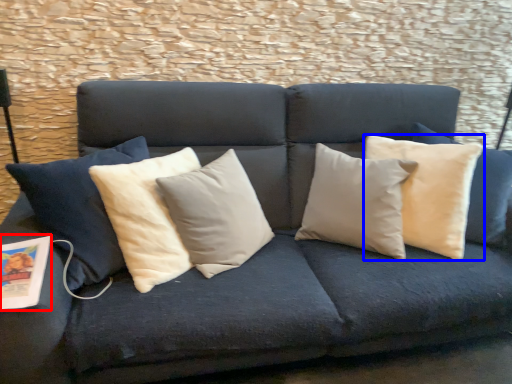
Question: Among these objects, which one is farthest to the camera, magazine (highlighted by a red box) or pillow (highlighted by a blue box)?

Choices:
 (A) magazine
 (B) pillow

Answer: (B)